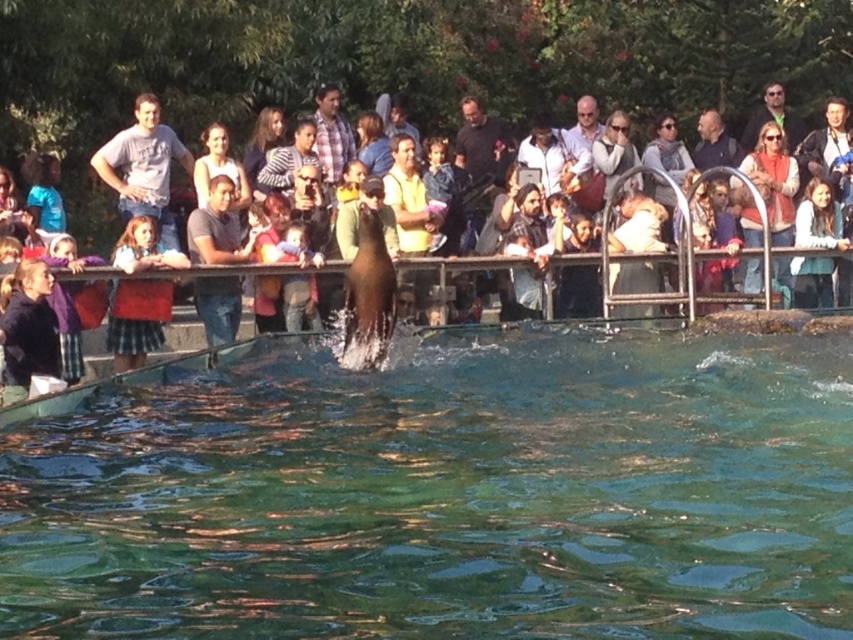
Question: Based on their relative distances, which object is nearer to the clear blue water at center?

Choices:
 (A) matte black sunglasses at upper right
 (B) metallic silver rail at center
 (C) blue fabric shirt at upper left
 (D) dark blue jeans at center

Answer: (B)

Question: Is dark blue jacket at left bigger than dark blue jeans at center?

Choices:
 (A) no
 (B) yes

Answer: (A)

Question: Is metallic silver rail at center to the right of matte black sunglasses at upper right from the viewer's perspective?

Choices:
 (A) no
 (B) yes

Answer: (A)

Question: Where is smooth skin crowd at upper center located in relation to matte black sunglasses at upper right in the image?

Choices:
 (A) below
 (B) above

Answer: (A)

Question: Among these points, which one is farthest from the camera?

Choices:
 (A) (788, 161)
 (B) (250, 244)

Answer: (A)

Question: Which object is positioned farthest from the light brown hair at upper center?

Choices:
 (A) matte gray t-shirt at upper left
 (B) clear blue water at center
 (C) plaid shirt at center
 (D) smooth skin crowd at upper center

Answer: (A)